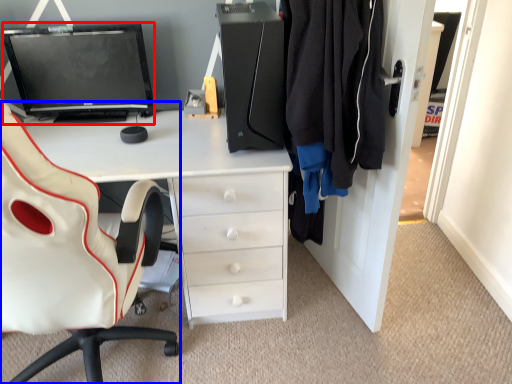
Question: Which point is further to the camera, computer monitor (highlighted by a red box) or chair (highlighted by a blue box)?

Choices:
 (A) computer monitor
 (B) chair

Answer: (A)